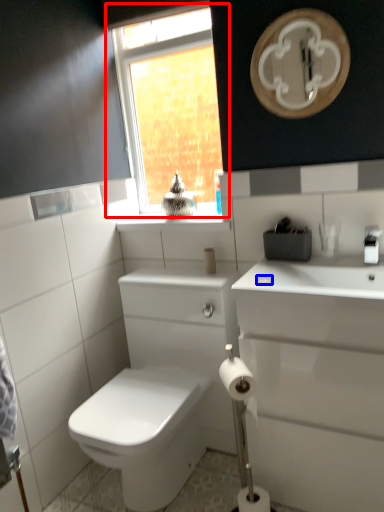
Question: Among these objects, which one is farthest to the camera, window (highlighted by a red box) or soap (highlighted by a blue box)?

Choices:
 (A) window
 (B) soap

Answer: (A)